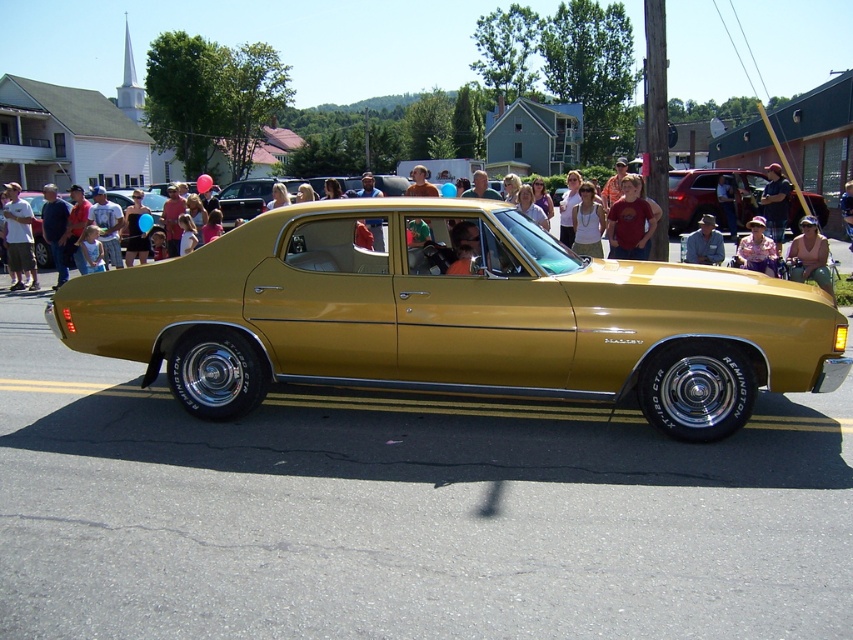
Question: Can you confirm if matte black shirt at left is bigger than dark blue shirt at center?

Choices:
 (A) no
 (B) yes

Answer: (A)

Question: Considering the real-world distances, which object is farthest from the matte gold shirt at center?

Choices:
 (A) gold shiny sedan at center
 (B) gold metallic sedan at center
 (C) matte gold car at center

Answer: (B)

Question: Among these objects, which one is nearest to the camera?

Choices:
 (A) matte red shirt at center
 (B) denim shirt at center
 (C) gold metallic sedan at center

Answer: (A)

Question: Is matte black shirt at left wider than matte gold shirt at center?

Choices:
 (A) no
 (B) yes

Answer: (B)

Question: Can you confirm if matte gold shirt at center is positioned to the right of dark blue shirt at center?

Choices:
 (A) no
 (B) yes

Answer: (A)

Question: Which object is positioned farthest from the matte red shirt at center?

Choices:
 (A) gold shiny sedan at center
 (B) matte black shirt at left
 (C) matte gold shirt at center

Answer: (B)